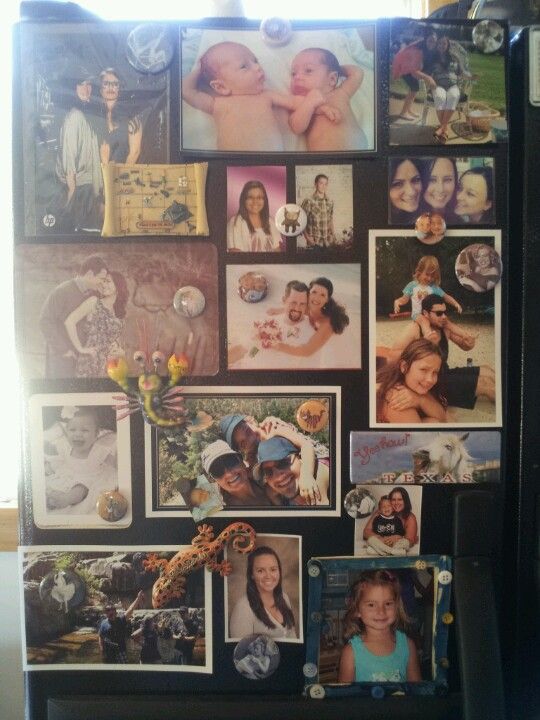
Locate an element on the screen. photo magnets is located at coordinates (423, 227), (472, 261), (487, 37), (357, 499), (256, 656).